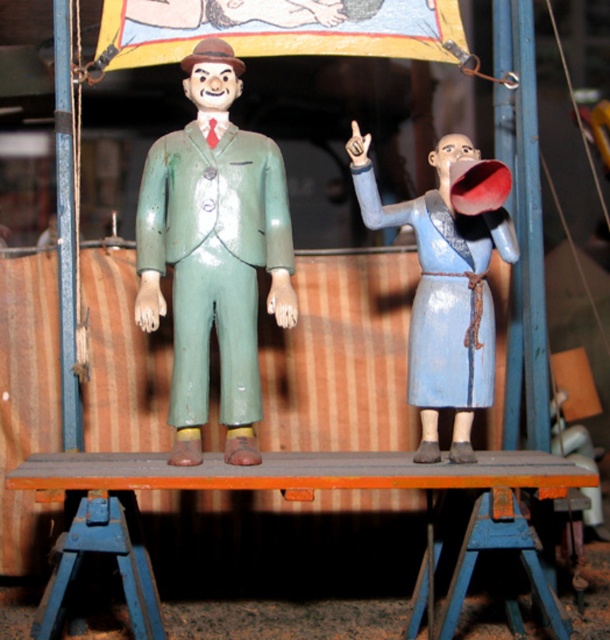
Question: Is green painted wood figure at center in front of blue matte megaphone at right?

Choices:
 (A) yes
 (B) no

Answer: (A)

Question: Where is green painted wood figure at center located in relation to blue matte megaphone at right in the image?

Choices:
 (A) below
 (B) above

Answer: (B)

Question: Does green painted wood figure at center appear on the left side of blue matte megaphone at right?

Choices:
 (A) no
 (B) yes

Answer: (B)

Question: Which point is closer to the camera?

Choices:
 (A) green painted wood figure at center
 (B) blue matte megaphone at right

Answer: (A)

Question: Which object is closer to the camera taking this photo?

Choices:
 (A) green painted wood figure at center
 (B) blue matte megaphone at right

Answer: (A)